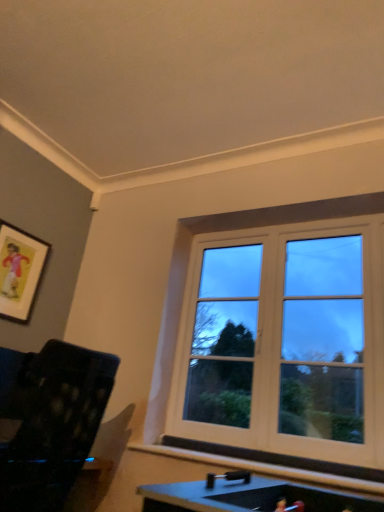
Image resolution: width=384 pixels, height=512 pixels. Describe the element at coordinates (19, 270) in the screenshot. I see `wooden framed picture at upper left` at that location.

Find the location of a particular element. wooden framed picture at upper left is located at coordinates (19, 270).

Locate an element on the screen. This screenshot has width=384, height=512. wooden framed picture at upper left is located at coordinates (19, 270).